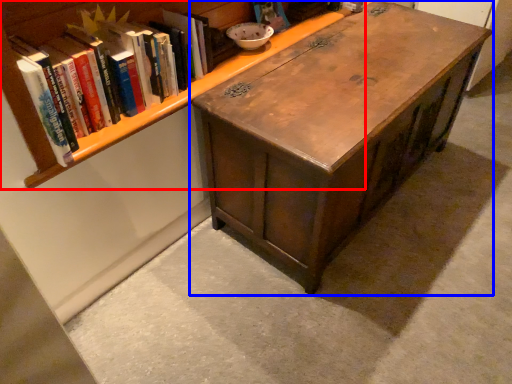
Question: Which of the following is the closest to the observer, bookcase (highlighted by a red box) or table (highlighted by a blue box)?

Choices:
 (A) bookcase
 (B) table

Answer: (A)